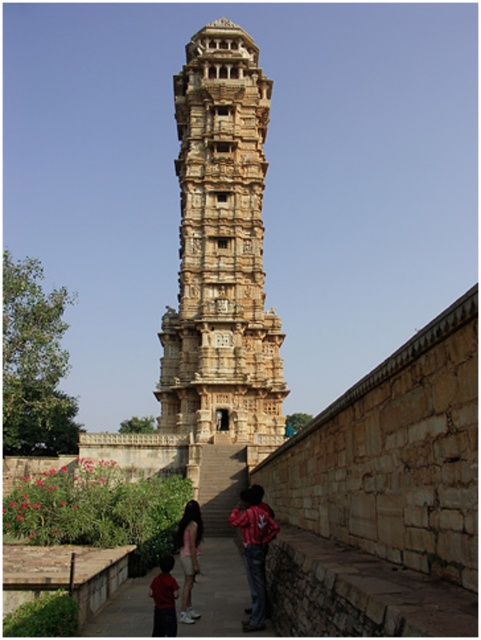
You are a photographer positioned at the base of the tower, aiming to capture a photo of the two clothing items mentioned. Given that the red and white textured shirt at center is wider than the light pink fabric at lower center, which clothing item would you focus on to ensure it fits entirely within your camera frame without cropping? Explain your reasoning.

The photographer should focus on the light pink fabric at lower center because it is narrower than the red and white textured shirt at center, making it easier to fit entirely within the camera frame without cropping.

You are standing at the entrance of the paved pathway leading to the stone carved tower at center. If you walk straight ahead, will you reach the tower?

Yes, because the paved pathway leads directly to the stone carved tower at center, so walking straight ahead will take you there.